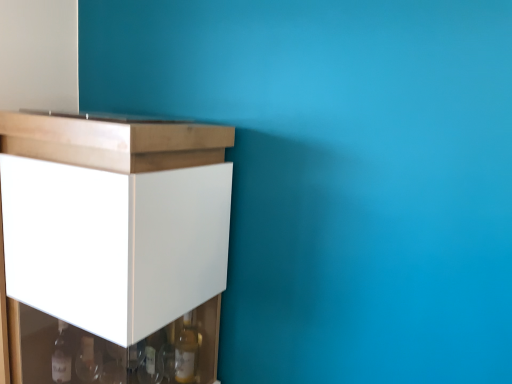
Describe the element at coordinates (111, 248) in the screenshot. Image resolution: width=512 pixels, height=384 pixels. I see `white glossy cabinet at left` at that location.

Where is `white glossy cabinet at left`? Image resolution: width=512 pixels, height=384 pixels. white glossy cabinet at left is located at coordinates (111, 248).

At what (x,y) coordinates should I click in order to perform the action: click on white glossy cabinet at left. Please return your answer as a coordinate pair (x, y). This screenshot has width=512, height=384. Looking at the image, I should click on (111, 248).